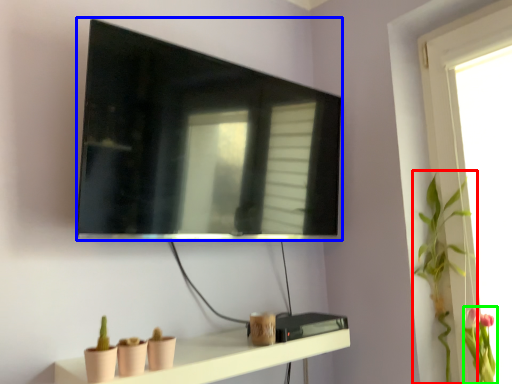
Question: Which is nearer to the plant (highlighted by a red box)? television (highlighted by a blue box) or floral arrangement (highlighted by a green box).

Choices:
 (A) television
 (B) floral arrangement

Answer: (B)